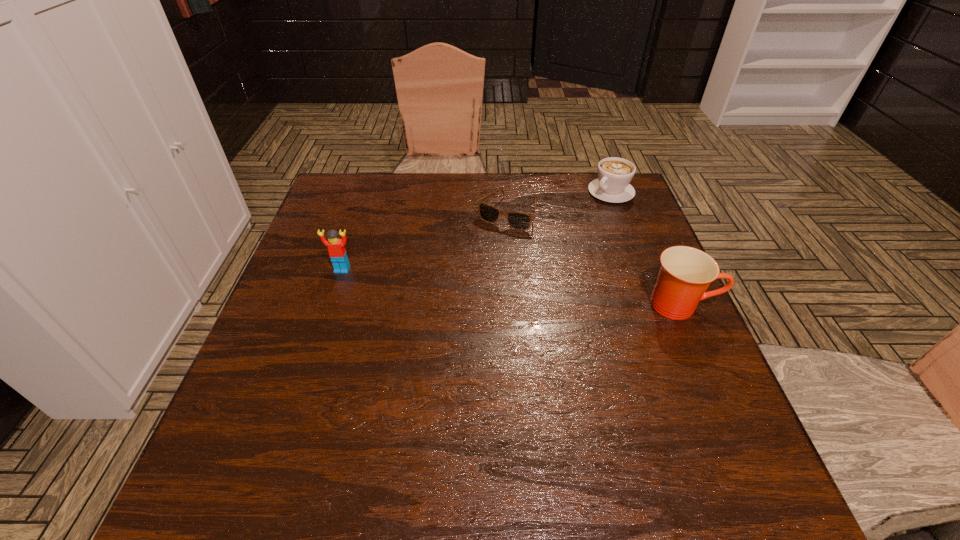
In the image, there is a desktop. Where is `free space at the far edge`? The width and height of the screenshot is (960, 540). free space at the far edge is located at coordinates (533, 198).

In the image, there is a desktop. Where is `vacant region at the near edge`? The height and width of the screenshot is (540, 960). vacant region at the near edge is located at coordinates (387, 437).

Locate an element on the screen. This screenshot has height=540, width=960. free region at the left edge is located at coordinates (355, 234).

Identify the location of free location at the right edge of the desktop. (688, 384).

You are a GUI agent. You are given a task and a screenshot of the screen. Output one action in this format:
    pyautogui.click(x=<x>, y=<y>)
    Task: Click on the vacant area at the far left corner
    The width and height of the screenshot is (960, 540).
    Given the screenshot: What is the action you would take?
    pyautogui.click(x=324, y=213)

The height and width of the screenshot is (540, 960). In the image, there is a desktop. Identify the location of free region at the near left corner. (271, 419).

At what (x,y) coordinates should I click in order to perform the action: click on unoccupied position between the cappuccino and the shortest object. Please return your answer as a coordinate pair (x, y). This screenshot has height=540, width=960. Looking at the image, I should click on (559, 202).

You are a GUI agent. You are given a task and a screenshot of the screen. Output one action in this format:
    pyautogui.click(x=<x>, y=<y>)
    Task: Click on the free area in between the shortest object and the second shortest object
    This screenshot has height=540, width=960.
    Given the screenshot: What is the action you would take?
    pyautogui.click(x=559, y=202)

Locate an element on the screen. The height and width of the screenshot is (540, 960). free space between the third tallest object and the nearest object is located at coordinates (646, 248).

Where is `vacant region between the shortest object and the third tallest object`? Image resolution: width=960 pixels, height=540 pixels. vacant region between the shortest object and the third tallest object is located at coordinates (559, 202).